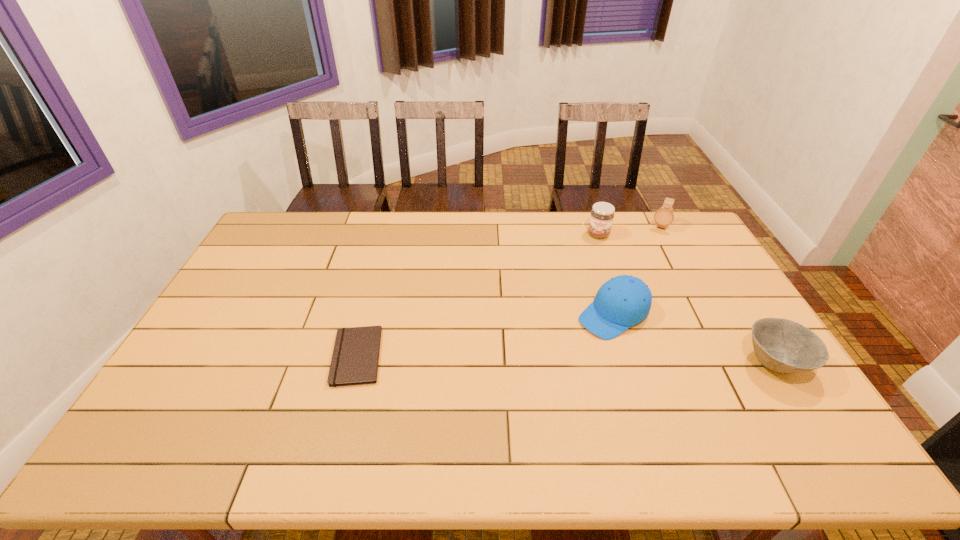
I want to click on vacant space on the desktop that is between the shortest object and the fourth tallest object and is positioned on the front label of the jam, so click(x=580, y=360).

Where is `free space on the desktop that is between the shortest object and the bowl and is positioned on the front-facing side of the cap`? This screenshot has height=540, width=960. free space on the desktop that is between the shortest object and the bowl and is positioned on the front-facing side of the cap is located at coordinates (548, 359).

Identify the location of vacant spot on the desktop that is between the leftmost object and the fourth tallest object and is positioned on the face of the watch. (603, 360).